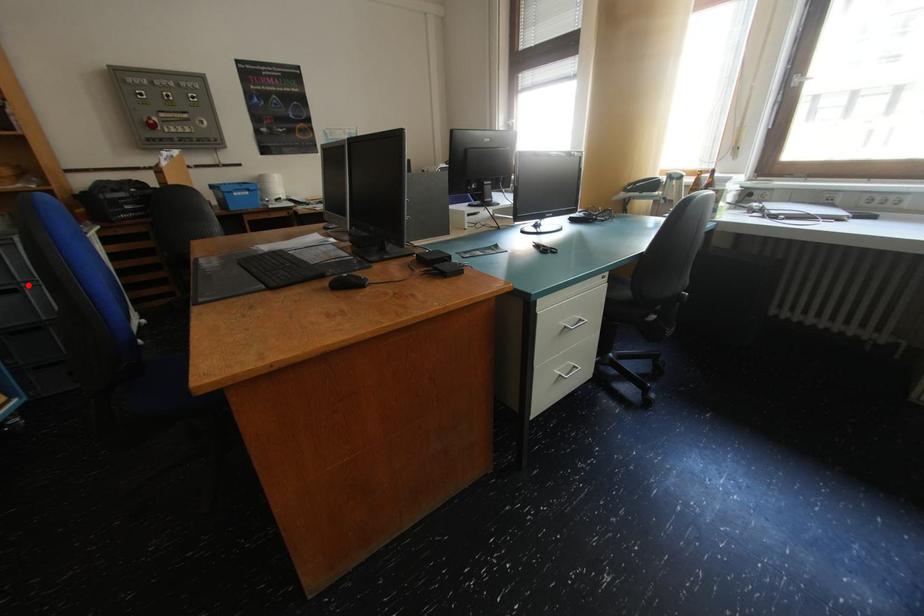
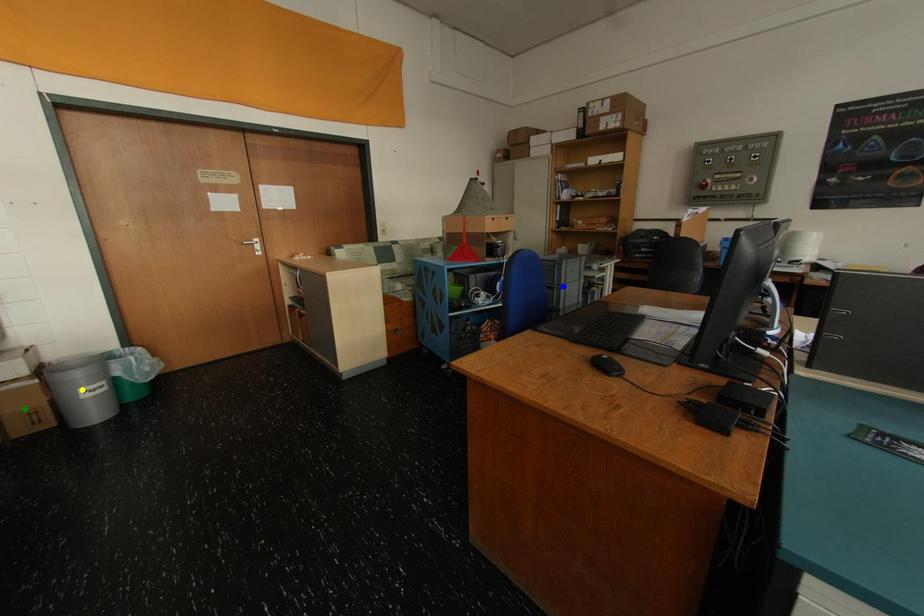
Question: I am providing you with two images of the same scene from different viewpoints. A red point is marked on the first image. You are given multiple points on the second image. Which spot in image 2 lines up with the point in image 1?

Choices:
 (A) blue point
 (B) green point
 (C) yellow point

Answer: (A)